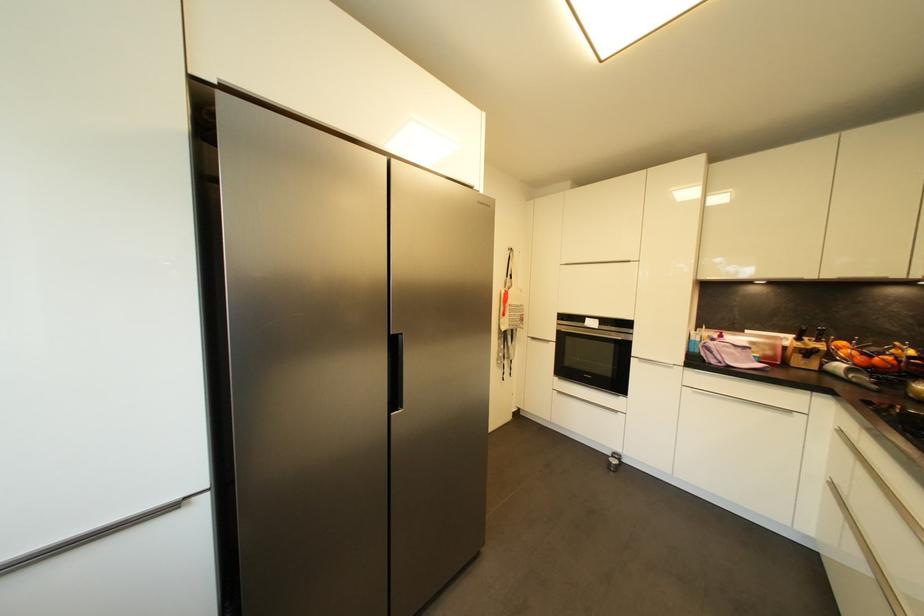
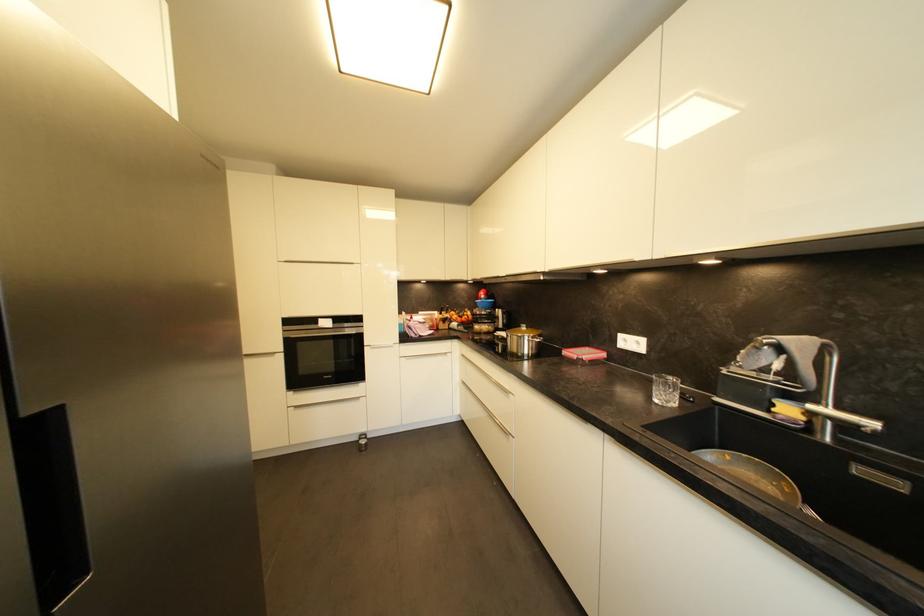
The point at (616, 458) is marked in the first image. Where is the corresponding point in the second image?

(365, 440)